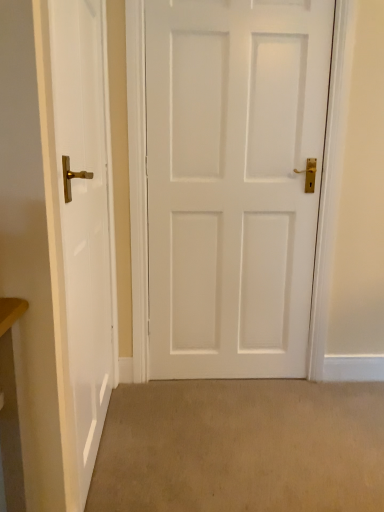
Describe the element at coordinates (84, 226) in the screenshot. The width and height of the screenshot is (384, 512). I see `white glossy door at left, which appears as the 1th door when viewed from the left` at that location.

What are the coordinates of `white matte door at center, placed as the 1th door when sorted from right to left` in the screenshot? It's located at (233, 182).

The width and height of the screenshot is (384, 512). What are the coordinates of `white glossy door at left, which appears as the 1th door when viewed from the left` in the screenshot? It's located at (84, 226).

How different are the orientations of beige carpet at lower center and white glossy door at left, the 2th door from the right, in degrees?

The angular difference between beige carpet at lower center and white glossy door at left, the 2th door from the right, is 1.53 degrees.

Considering the relative positions of beige carpet at lower center and white glossy door at left, which appears as the 1th door when viewed from the left, in the image provided, is beige carpet at lower center behind white glossy door at left, which appears as the 1th door when viewed from the left,?

Yes, beige carpet at lower center is further from the viewer.

Does beige carpet at lower center appear on the right side of white glossy door at left, the 2th door from the right?

Yes.

Can you confirm if beige carpet at lower center is wider than white glossy door at left, the 2th door from the right?

Indeed, beige carpet at lower center has a greater width compared to white glossy door at left, the 2th door from the right.

Which object is further away from the camera taking this photo, white matte door at center, placed as the 1th door when sorted from right to left, or beige carpet at lower center?

white matte door at center, placed as the 1th door when sorted from right to left, is further away from the camera.

Is beige carpet at lower center at the back of white matte door at center, the second door positioned from the left?

No, white matte door at center, the second door positioned from the left, is not facing away from beige carpet at lower center.

Can you confirm if white matte door at center, placed as the 1th door when sorted from right to left, is thinner than beige carpet at lower center?

Yes, white matte door at center, placed as the 1th door when sorted from right to left, is thinner than beige carpet at lower center.

Where is `door on the right of white glossy door at left, which appears as the 1th door when viewed from the left`? The image size is (384, 512). door on the right of white glossy door at left, which appears as the 1th door when viewed from the left is located at coordinates (233, 182).

Considering the positions of objects white matte door at center, the second door positioned from the left, and white glossy door at left, the 2th door from the right, in the image provided, who is more to the right, white matte door at center, the second door positioned from the left, or white glossy door at left, the 2th door from the right,?

white matte door at center, the second door positioned from the left, is more to the right.

Based on their sizes in the image, would you say white matte door at center, the second door positioned from the left, is bigger or smaller than white glossy door at left, which appears as the 1th door when viewed from the left?

Clearly, white matte door at center, the second door positioned from the left, is larger in size than white glossy door at left, which appears as the 1th door when viewed from the left.

Is white glossy door at left, the 2th door from the right, facing towards beige carpet at lower center?

Yes, white glossy door at left, the 2th door from the right, is oriented towards beige carpet at lower center.

Is beige carpet at lower center surrounded by white glossy door at left, the 2th door from the right?

Definitely not — beige carpet at lower center is not inside white glossy door at left, the 2th door from the right.

Is white glossy door at left, which appears as the 1th door when viewed from the left, taller or shorter than beige carpet at lower center?

In the image, white glossy door at left, which appears as the 1th door when viewed from the left, appears to be taller than beige carpet at lower center.

Is white glossy door at left, the 2th door from the right, wider or thinner than white matte door at center, the second door positioned from the left?

Clearly, white glossy door at left, the 2th door from the right, has less width compared to white matte door at center, the second door positioned from the left.

Could you tell me if white glossy door at left, which appears as the 1th door when viewed from the left, is facing white matte door at center, placed as the 1th door when sorted from right to left?

Yes, white glossy door at left, which appears as the 1th door when viewed from the left, is oriented towards white matte door at center, placed as the 1th door when sorted from right to left.

What's the angular difference between white glossy door at left, the 2th door from the right, and white matte door at center, the second door positioned from the left,'s facing directions?

white glossy door at left, the 2th door from the right, and white matte door at center, the second door positioned from the left, are facing 90.2 degrees away from each other.

Is white glossy door at left, which appears as the 1th door when viewed from the left, beside white matte door at center, the second door positioned from the left?

white glossy door at left, which appears as the 1th door when viewed from the left, and white matte door at center, the second door positioned from the left, are clearly separated.

From the picture: From a real-world perspective, is beige carpet at lower center physically located above or below white matte door at center, placed as the 1th door when sorted from right to left?

beige carpet at lower center is below white matte door at center, placed as the 1th door when sorted from right to left.

In the scene shown: Are beige carpet at lower center and white matte door at center, the second door positioned from the left, making contact?

There is a gap between beige carpet at lower center and white matte door at center, the second door positioned from the left.

Considering the sizes of objects beige carpet at lower center and white matte door at center, placed as the 1th door when sorted from right to left, in the image provided, who is shorter, beige carpet at lower center or white matte door at center, placed as the 1th door when sorted from right to left,?

Standing shorter between the two is beige carpet at lower center.

Which door is the 2nd one when counting from the left side of the beige carpet at lower center? Please provide its 2D coordinates.

[(84, 226)]

Where is `door that is the 2nd one above the beige carpet at lower center (from a real-world perspective)`? door that is the 2nd one above the beige carpet at lower center (from a real-world perspective) is located at coordinates (233, 182).

Based on their spatial positions, is beige carpet at lower center or white matte door at center, placed as the 1th door when sorted from right to left, further from white glossy door at left, the 2th door from the right?

Among the two, beige carpet at lower center is located further to white glossy door at left, the 2th door from the right.

Looking at the image, which one is located closer to beige carpet at lower center, white glossy door at left, the 2th door from the right, or white matte door at center, placed as the 1th door when sorted from right to left?

white glossy door at left, the 2th door from the right, lies closer to beige carpet at lower center than the other object.

When comparing their distances from white matte door at center, placed as the 1th door when sorted from right to left, does beige carpet at lower center or white glossy door at left, which appears as the 1th door when viewed from the left, seem further?

Based on the image, beige carpet at lower center appears to be further to white matte door at center, placed as the 1th door when sorted from right to left.

Based on their spatial positions, is white matte door at center, placed as the 1th door when sorted from right to left, or beige carpet at lower center closer to white glossy door at left, the 2th door from the right?

white matte door at center, placed as the 1th door when sorted from right to left.

Based on their spatial positions, is white glossy door at left, the 2th door from the right, or beige carpet at lower center further from white matte door at center, the second door positioned from the left?

Based on the image, beige carpet at lower center appears to be further to white matte door at center, the second door positioned from the left.

Based on their spatial positions, is white matte door at center, the second door positioned from the left, or white glossy door at left, the 2th door from the right, closer to beige carpet at lower center?

white glossy door at left, the 2th door from the right, is positioned closer to the anchor beige carpet at lower center.

At what (x,y) coordinates should I click in order to perform the action: click on door that lies between white matte door at center, the second door positioned from the left, and beige carpet at lower center from top to bottom. Please return your answer as a coordinate pair (x, y). The image size is (384, 512). Looking at the image, I should click on (84, 226).